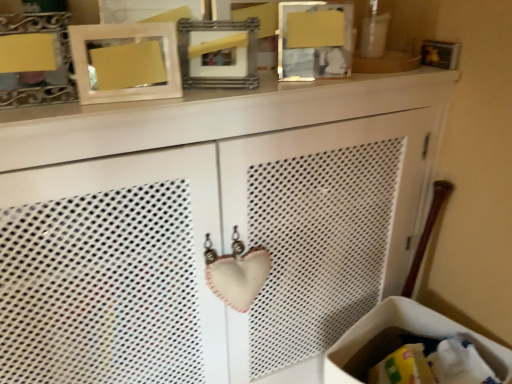
Where is `free location in front of metallic silver picture frame at upper center, acting as the second picture frame starting from the right`? free location in front of metallic silver picture frame at upper center, acting as the second picture frame starting from the right is located at coordinates (193, 109).